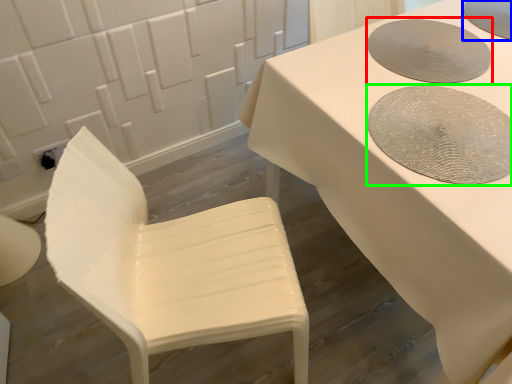
Question: Which object is positioned closest to manhole cover (highlighted by a red box)? Select from manhole cover (highlighted by a blue box) and manhole cover (highlighted by a green box).

Choices:
 (A) manhole cover
 (B) manhole cover

Answer: (B)